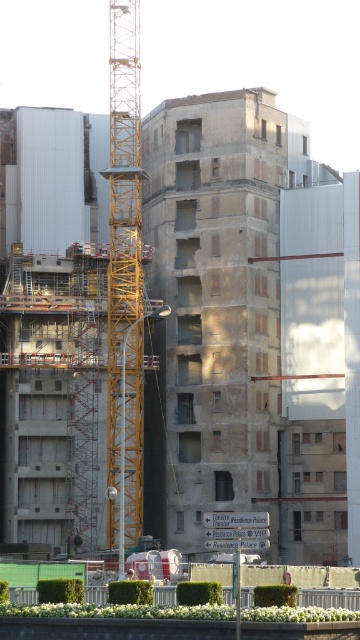
Which of these two, yellow metallic crane at center or concrete wall at center, stands taller?

yellow metallic crane at center

Is yellow metallic crane at center to the left of concrete wall at center from the viewer's perspective?

Correct, you'll find yellow metallic crane at center to the left of concrete wall at center.

Is point (141, 387) positioned in front of point (132, 611)?

No, it is behind (132, 611).

Find the location of a particular element. The image size is (360, 640). yellow metallic crane at center is located at coordinates (124, 280).